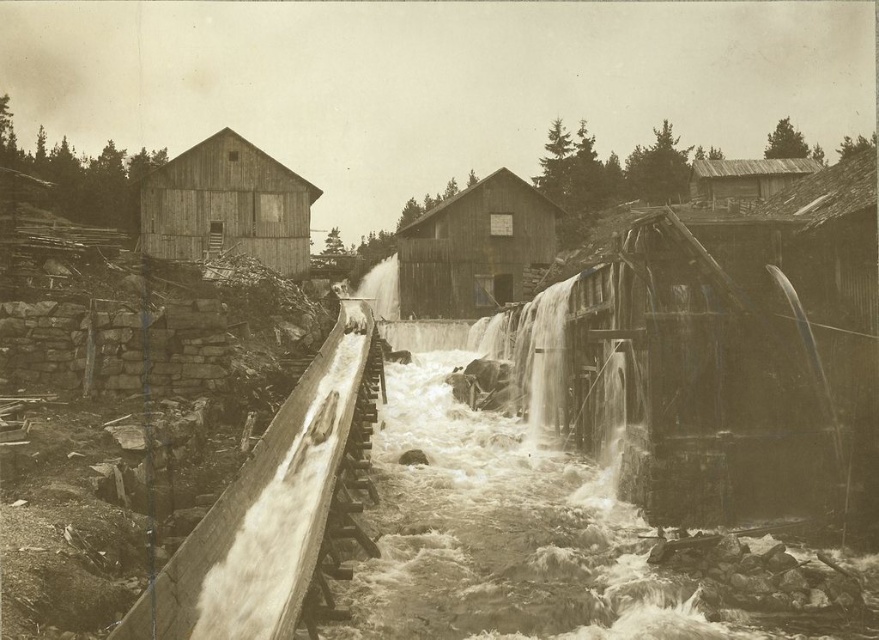
Is rough stone river at center smaller than smooth concrete waterfall at center?

Incorrect, rough stone river at center is not smaller in size than smooth concrete waterfall at center.

Which is more to the left, rough stone river at center or smooth concrete waterfall at center?

Positioned to the left is rough stone river at center.

What do you see at coordinates (514, 538) in the screenshot? This screenshot has width=879, height=640. I see `rough stone river at center` at bounding box center [514, 538].

Where is `rough stone river at center`? Image resolution: width=879 pixels, height=640 pixels. rough stone river at center is located at coordinates (514, 538).

Is wooden hut at left below white frothy water at center?

No.

In the scene shown: Is wooden hut at left to the left of white frothy water at center from the viewer's perspective?

Yes, wooden hut at left is to the left of white frothy water at center.

Does point (249, 241) come in front of point (396, 259)?

Yes, it is in front of point (396, 259).

This screenshot has width=879, height=640. Find the location of `wooden hut at left`. wooden hut at left is located at coordinates (226, 205).

Is the position of wooden hut at center less distant than that of white frothy water at center?

Yes, it is.

Can you confirm if wooden hut at center is smaller than white frothy water at center?

No, wooden hut at center is not smaller than white frothy water at center.

Is point (452, 240) behind point (378, 289)?

No.

Find the location of `wooden hut at center`. wooden hut at center is located at coordinates (476, 248).